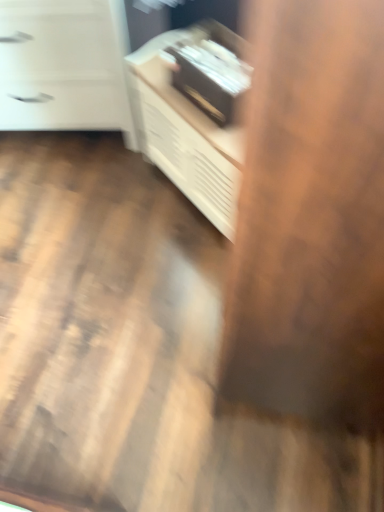
What are the coordinates of `vacant space situated on the left part of white wood cabinet at upper center` in the screenshot? It's located at (110, 201).